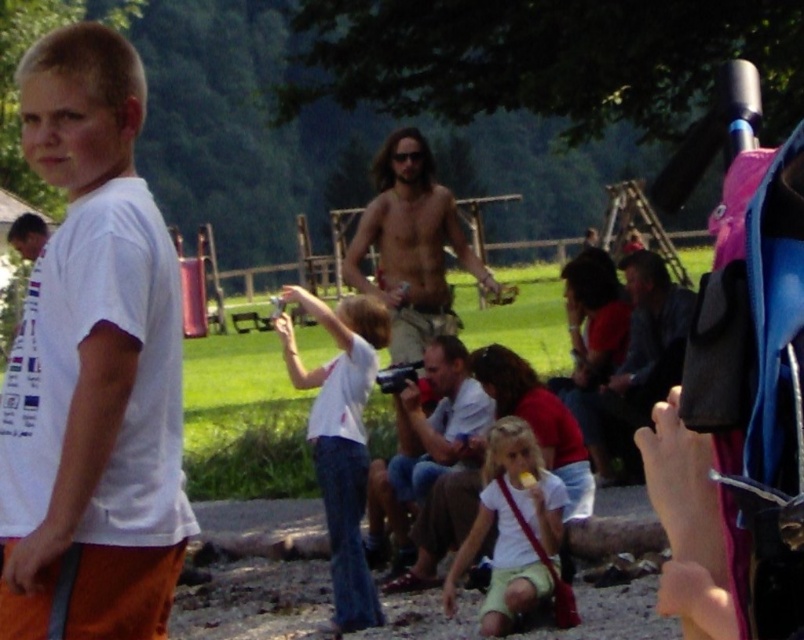
You are a photographer trying to capture a candid shot of the white matte shirt at center and dark blue jeans at center in the scene. Which of the two items should you focus on first if you want to include both in the frame without zooming in further?

The white matte shirt at center is smaller than dark blue jeans at center, so you should focus on the white matte shirt at center first to ensure it is in frame before adjusting for the larger dark blue jeans at center.